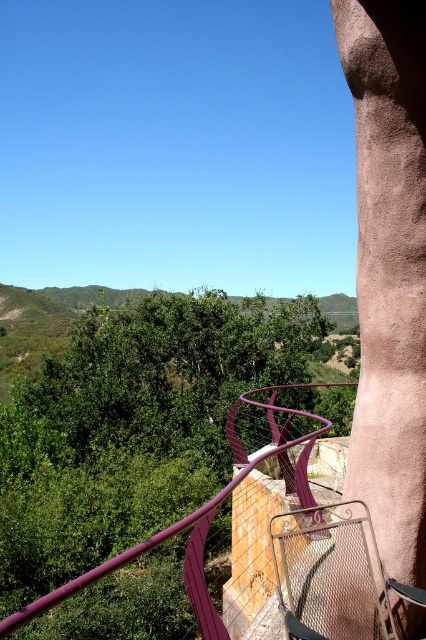
Looking at this image, does green leafy tree at center lie behind purple metallic railing at upper right?

That is True.

Does green leafy tree at center appear under purple metallic railing at upper right?

Indeed, green leafy tree at center is positioned under purple metallic railing at upper right.

Who is more forward, (74,378) or (121,556)?

Point (121,556)

Find the location of a particular element. Image resolution: width=426 pixels, height=640 pixels. green leafy tree at center is located at coordinates (169, 371).